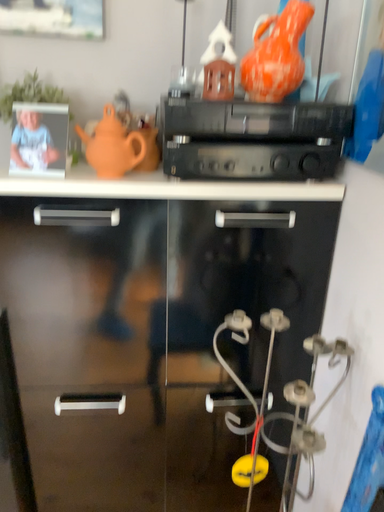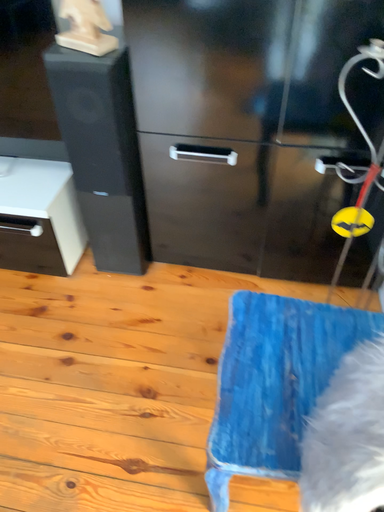
Question: Which way did the camera rotate in the video?

Choices:
 (A) rotated left
 (B) rotated right

Answer: (A)